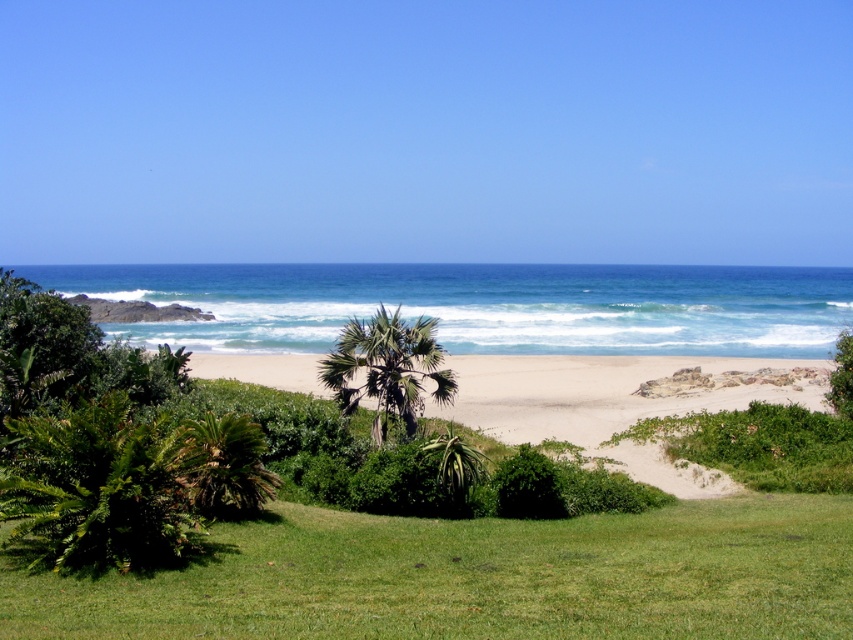
Question: Among these points, which one is nearest to the camera?

Choices:
 (A) (699, 410)
 (B) (280, 561)

Answer: (B)

Question: Can you confirm if beige sand at center is wider than green leafy palm tree at lower left?

Choices:
 (A) yes
 (B) no

Answer: (A)

Question: Which of the following is the farthest from the observer?

Choices:
 (A) green leafy palm tree at lower left
 (B) green leafy palm tree at center

Answer: (B)

Question: Among these objects, which one is nearest to the camera?

Choices:
 (A) beige sand at center
 (B) green leafy palm tree at lower left
 (C) green leafy palm tree at center
 (D) green grassy at lower center

Answer: (D)

Question: Does beige sand at center have a lesser width compared to green leafy palm tree at lower left?

Choices:
 (A) yes
 (B) no

Answer: (B)

Question: In this image, where is beige sand at center located relative to green leafy palm tree at center?

Choices:
 (A) below
 (B) above

Answer: (A)